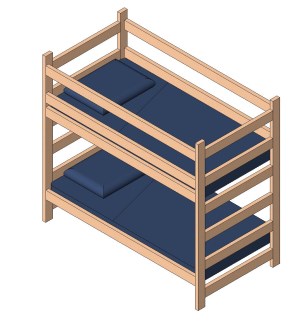
You are a GUI agent. You are given a task and a screenshot of the screen. Output one action in this format:
    pyautogui.click(x=<x>, y=<y>)
    Task: Click on the sheets
    
    Given the screenshot: What is the action you would take?
    pyautogui.click(x=179, y=115)